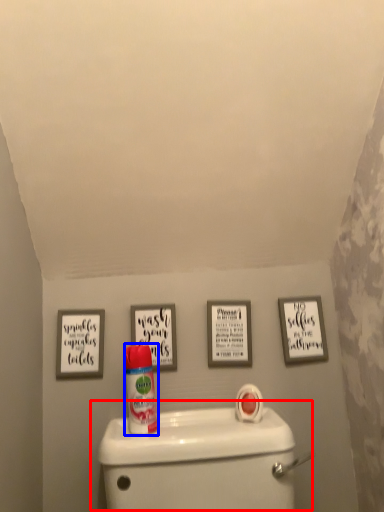
Question: Which of the following is the farthest to the observer, toilet (highlighted by a red box) or cleaning product (highlighted by a blue box)?

Choices:
 (A) toilet
 (B) cleaning product

Answer: (B)